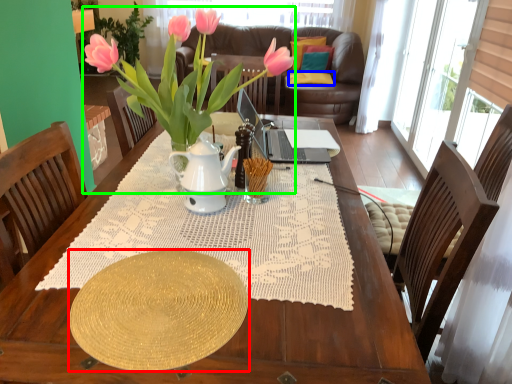
Question: Estimate the real-world distances between objects in this image. Which object is closer to plate (highlighted by a red box), pillow (highlighted by a blue box) or houseplant (highlighted by a green box)?

Choices:
 (A) pillow
 (B) houseplant

Answer: (B)